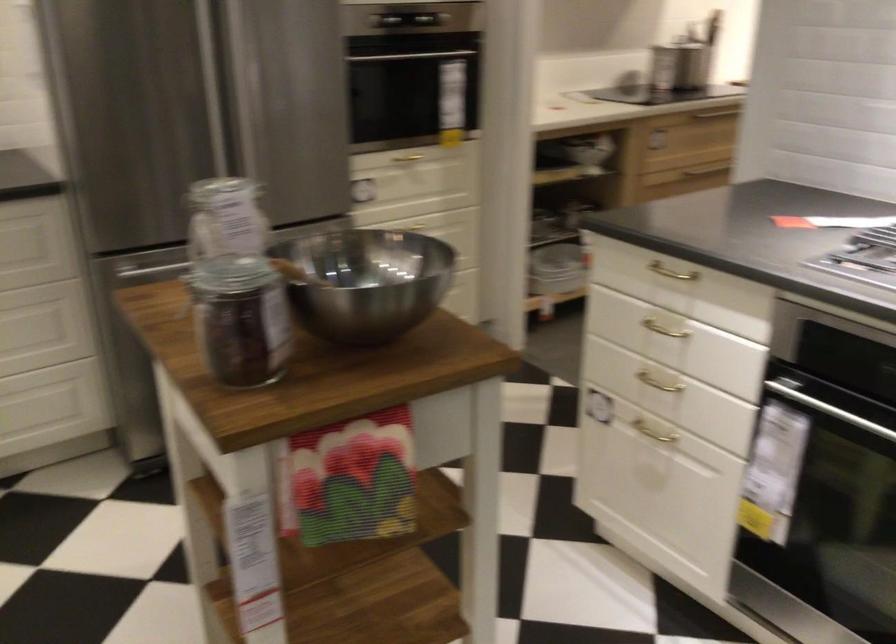
This screenshot has height=644, width=896. What do you see at coordinates (826, 408) in the screenshot?
I see `the oven handle` at bounding box center [826, 408].